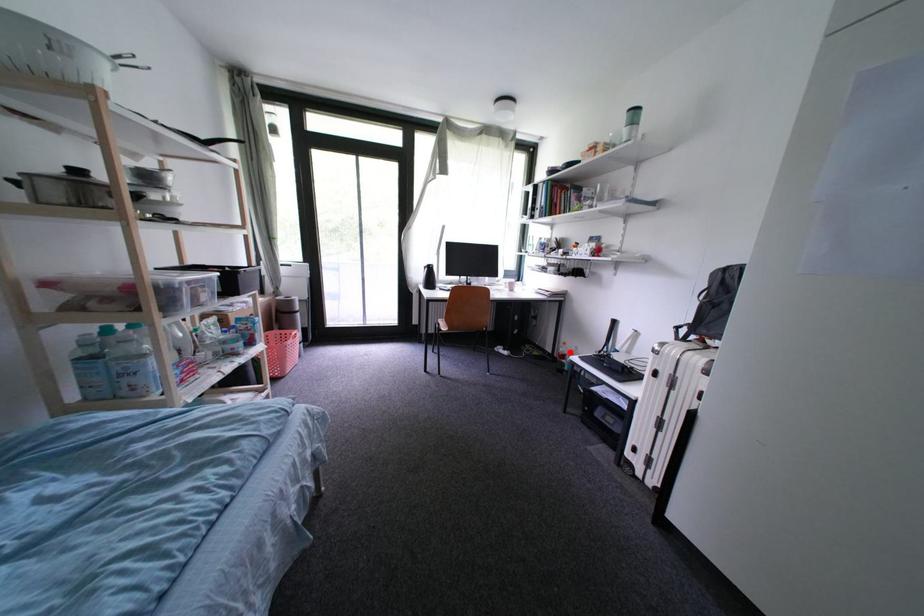
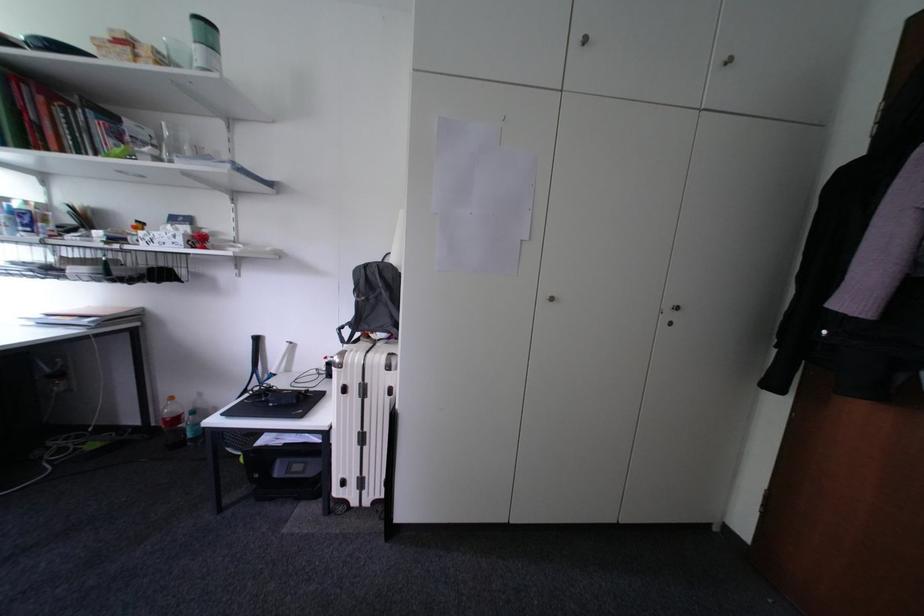
Question: I am providing you with two images of the same scene from different viewpoints. Image1 has a red point marked. In image2, the corresponding 3D location appears at what relative position? Reply with the corresponding letter.

Choices:
 (A) Closer
 (B) Farther

Answer: (B)